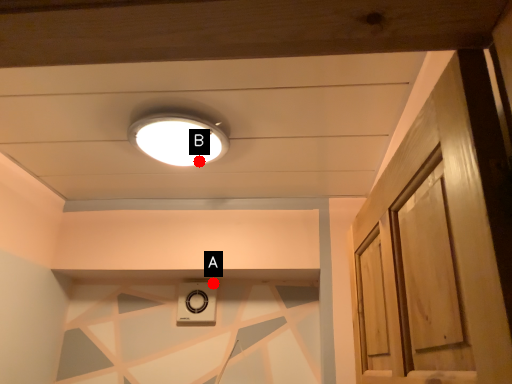
Question: Two points are circled on the image, labeled by A and B beside each circle. Which of the following is the closest to the observer?

Choices:
 (A) A is closer
 (B) B is closer

Answer: (B)